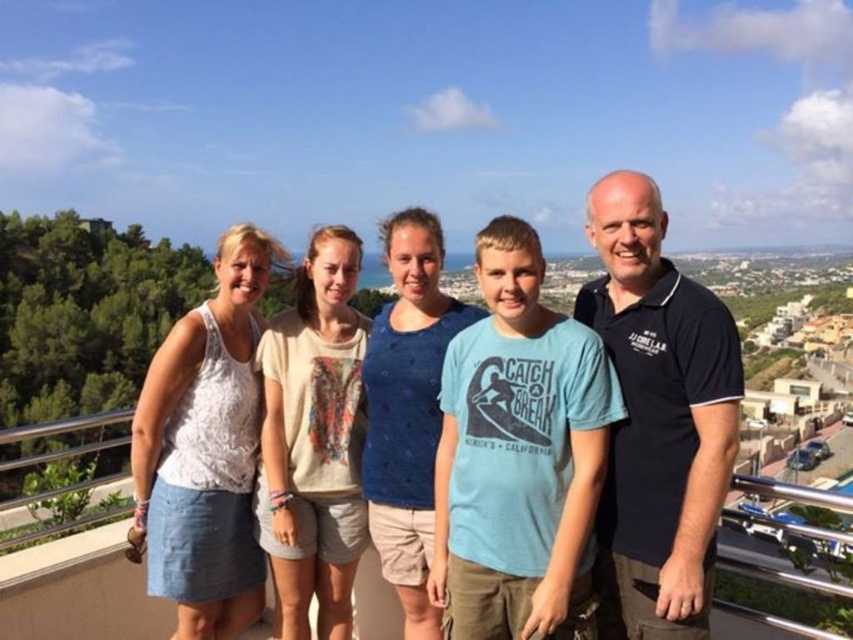
Question: Where is white cotton tank top at center located in relation to white lace tank top at upper left in the image?

Choices:
 (A) below
 (B) above

Answer: (A)

Question: Is white cotton tank top at center to the left of white lace tank top at upper left from the viewer's perspective?

Choices:
 (A) yes
 (B) no

Answer: (B)

Question: Which of the following is the farthest from the observer?

Choices:
 (A) (229, 556)
 (B) (621, 467)

Answer: (B)

Question: Where is white cotton tank top at center located in relation to white lace tank top at upper left in the image?

Choices:
 (A) below
 (B) above

Answer: (A)